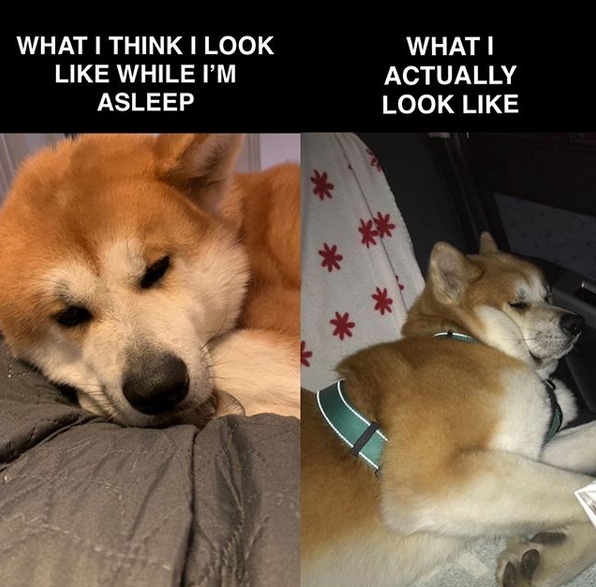
The height and width of the screenshot is (587, 596). I want to click on sheet, so click(216, 535).